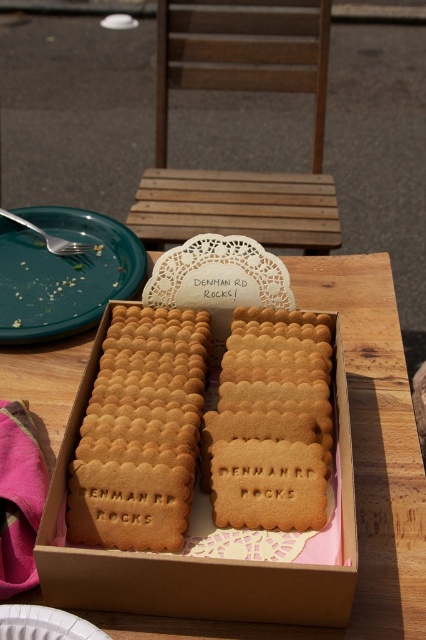
You are standing in front of a wooden picnic table at center. If you want to place a 2.5 feet wide picnic basket on the table, will it fit on the table?

The wooden picnic table at center is 5.69 feet from viewer. The distance from the viewer to the table doesn

You are setting up a picnic and have a green matte plate at left and a brown cardboard box at center. If you want to place a napkin between them, where should you put it?

The napkin should be placed between the green matte plate at left and the brown cardboard box at center, to the right of the green matte plate at left and to the left of the brown cardboard box at center.

You are standing at the edge of the table looking towards the box of biscuits. There are two points marked on the table surface. One is at coordinate point (x=173, y=589) and the other at point (x=57, y=632). Which point is closer to you?

Point (x=173, y=589) is closer to you because it is further to the viewer than point (x=57, y=632).